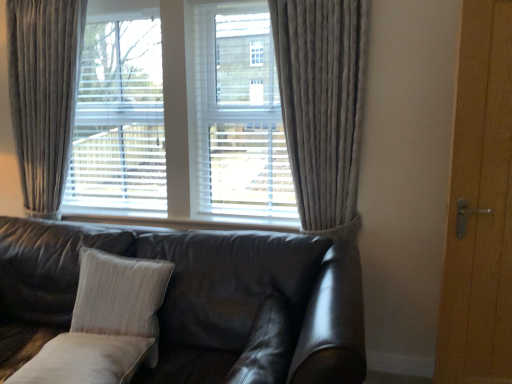
Question: Could you tell me if leather couch at center is turned towards velvet gray curtain at left, acting as the 2th curtain starting from the right?

Choices:
 (A) no
 (B) yes

Answer: (A)

Question: From the image's perspective, is leather couch at center below velvet gray curtain at left, acting as the 2th curtain starting from the right?

Choices:
 (A) yes
 (B) no

Answer: (A)

Question: Is leather couch at center far from velvet gray curtain at left, acting as the 2th curtain starting from the right?

Choices:
 (A) no
 (B) yes

Answer: (B)

Question: From a real-world perspective, is leather couch at center positioned over velvet gray curtain at left, acting as the 2th curtain starting from the right, based on gravity?

Choices:
 (A) no
 (B) yes

Answer: (A)

Question: Is leather couch at center at the right side of velvet gray curtain at left, acting as the 2th curtain starting from the right?

Choices:
 (A) yes
 (B) no

Answer: (A)

Question: From the image's perspective, is leather couch at center above velvet gray curtain at left, which is the first curtain from left to right?

Choices:
 (A) yes
 (B) no

Answer: (B)

Question: Is velvet gray curtain at left, acting as the 2th curtain starting from the right, to the right of suede-like beige pillow at lower center, the 1th pillow from the front, from the viewer's perspective?

Choices:
 (A) yes
 (B) no

Answer: (B)

Question: Considering the relative sizes of velvet gray curtain at left, acting as the 2th curtain starting from the right, and suede-like beige pillow at lower center, the 2th pillow in the left-to-right sequence, in the image provided, is velvet gray curtain at left, acting as the 2th curtain starting from the right, shorter than suede-like beige pillow at lower center, the 2th pillow in the left-to-right sequence,?

Choices:
 (A) yes
 (B) no

Answer: (B)

Question: Can you confirm if velvet gray curtain at left, which is the first curtain from left to right, is bigger than suede-like beige pillow at lower center, marked as the 1th pillow in a right-to-left arrangement?

Choices:
 (A) no
 (B) yes

Answer: (B)

Question: Does velvet gray curtain at left, which is the first curtain from left to right, have a greater height compared to suede-like beige pillow at lower center, the second pillow from the back?

Choices:
 (A) no
 (B) yes

Answer: (B)

Question: From the image's perspective, is velvet gray curtain at left, which is the first curtain from left to right, below suede-like beige pillow at lower center, the second pillow from the back?

Choices:
 (A) yes
 (B) no

Answer: (B)

Question: Is suede-like beige pillow at lower center, the 1th pillow from the front, at the back of velvet gray curtain at left, acting as the 2th curtain starting from the right?

Choices:
 (A) yes
 (B) no

Answer: (B)

Question: Are suede-like beige pillow at lower center, the 2th pillow in the left-to-right sequence, and leather couch at center far apart?

Choices:
 (A) yes
 (B) no

Answer: (B)